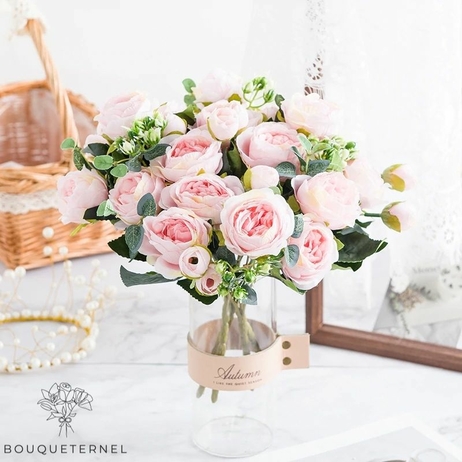
Find the location of a particular element. This screenshot has height=462, width=462. wicker handle is located at coordinates (66, 125), (40, 44).